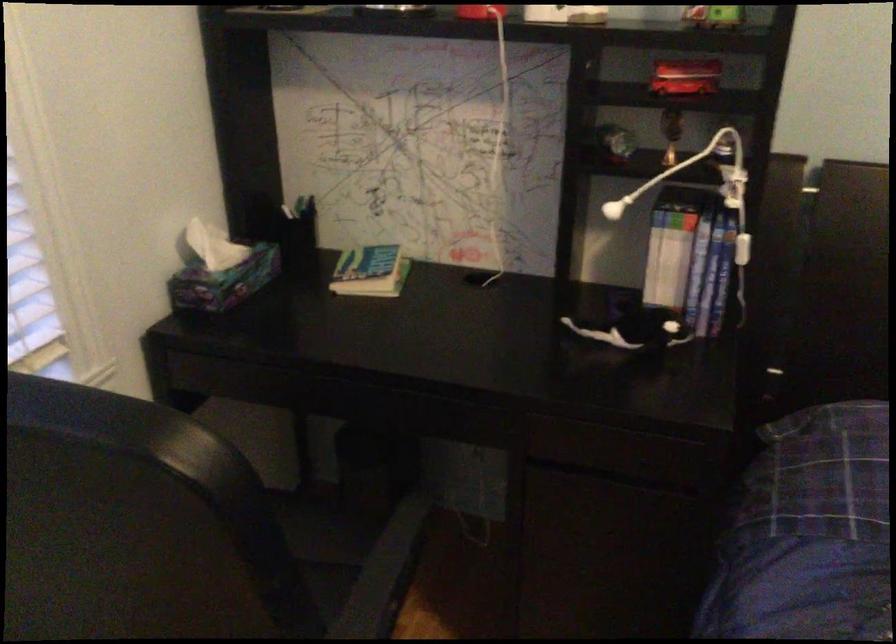
The width and height of the screenshot is (896, 644). What are the coordinates of `chair sitting surface` in the screenshot? It's located at (334, 533).